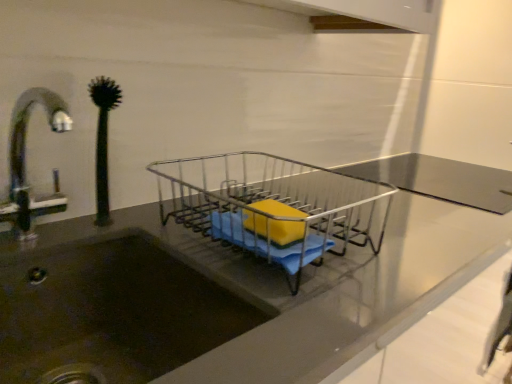
What do you see at coordinates (274, 206) in the screenshot? This screenshot has height=384, width=512. I see `metallic wire dish rack at center` at bounding box center [274, 206].

From the picture: Measure the distance between yellow sponge at center and camera.

25.71 inches.

You are a GUI agent. You are given a task and a screenshot of the screen. Output one action in this format:
    pyautogui.click(x=<x>, y=<y>)
    Task: Click on the green rubber plant at left
    
    Given the screenshot: What is the action you would take?
    pyautogui.click(x=103, y=142)

In order to click on metallic wire dish rack at center in this screenshot , I will do `click(274, 206)`.

Based on their positions, is green rubber plant at left located to the left or right of metallic wire dish rack at center?

Based on their positions, green rubber plant at left is located to the left of metallic wire dish rack at center.

Can you tell me how much green rubber plant at left and metallic wire dish rack at center differ in facing direction?

The angular difference between green rubber plant at left and metallic wire dish rack at center is 1.94e-05 degrees.

Is green rubber plant at left looking in the opposite direction of metallic wire dish rack at center?

green rubber plant at left is not turned away from metallic wire dish rack at center.

Is metallic wire dish rack at center located within green rubber plant at left?

No, green rubber plant at left does not contain metallic wire dish rack at center.

Based on their sizes in the image, would you say metallic wire dish rack at center is bigger or smaller than green rubber plant at left?

metallic wire dish rack at center is bigger than green rubber plant at left.

From a real-world perspective, who is located lower, metallic wire dish rack at center or green rubber plant at left?

metallic wire dish rack at center is physically lower.

Which is less distant, (379, 188) or (102, 207)?

Point (379, 188) appears to be farther away from the viewer than point (102, 207).

Would you say metallic wire dish rack at center is to the left or to the right of green rubber plant at left in the picture?

metallic wire dish rack at center is positioned on green rubber plant at left's right side.

Is yellow sponge at center positioned beyond the bounds of green rubber plant at left?

Yes, yellow sponge at center is not within green rubber plant at left.

Considering the relative sizes of yellow sponge at center and green rubber plant at left in the image provided, is yellow sponge at center taller than green rubber plant at left?

In fact, yellow sponge at center may be shorter than green rubber plant at left.

Which is more to the left, yellow sponge at center or green rubber plant at left?

green rubber plant at left.

From the image's perspective, is yellow sponge at center above or below green rubber plant at left?

Clearly, from the image's perspective, yellow sponge at center is below green rubber plant at left.

Is yellow sponge at center with metallic wire dish rack at center?

yellow sponge at center and metallic wire dish rack at center are not in contact.

From the image's perspective, is yellow sponge at center over metallic wire dish rack at center?

No, from the image's perspective, yellow sponge at center is not over metallic wire dish rack at center.

How many degrees apart are the facing directions of yellow sponge at center and metallic wire dish rack at center?

The facing directions of yellow sponge at center and metallic wire dish rack at center are 4.42 degrees apart.

From a real-world perspective, does yellow sponge at center sit lower than metallic wire dish rack at center?

No, from a real-world perspective, yellow sponge at center is not beneath metallic wire dish rack at center.

Is metallic wire dish rack at center not within yellow sponge at center?

Yes.

Which object is more forward, metallic wire dish rack at center or yellow sponge at center?

metallic wire dish rack at center is more forward.

Does metallic wire dish rack at center have a smaller size compared to yellow sponge at center?

Actually, metallic wire dish rack at center might be larger than yellow sponge at center.

In terms of width, does metallic wire dish rack at center look wider or thinner when compared to yellow sponge at center?

In the image, metallic wire dish rack at center appears to be wider than yellow sponge at center.

Is yellow sponge at center inside green rubber plant at left?

Definitely not — yellow sponge at center is not inside green rubber plant at left.

From the picture: Is green rubber plant at left to the left of yellow sponge at center from the viewer's perspective?

Indeed, green rubber plant at left is positioned on the left side of yellow sponge at center.

Is green rubber plant at left not close to yellow sponge at center?

They are positioned close to each other.

Can you tell me how much green rubber plant at left and yellow sponge at center differ in facing direction?

The facing directions of green rubber plant at left and yellow sponge at center are 4.42 degrees apart.

Where is `trolley below the green rubber plant at left (from a real-world perspective)`? The height and width of the screenshot is (384, 512). trolley below the green rubber plant at left (from a real-world perspective) is located at coordinates (274, 206).

Find the location of a particular element. The height and width of the screenshot is (384, 512). trolley that appears below the green rubber plant at left (from the image's perspective) is located at coordinates (274, 206).

Which object lies further to the anchor point green rubber plant at left, metallic wire dish rack at center or yellow sponge at center?

Based on the image, metallic wire dish rack at center appears to be further to green rubber plant at left.

Considering their positions, is yellow sponge at center positioned further to metallic wire dish rack at center than green rubber plant at left?

green rubber plant at left is further to metallic wire dish rack at center.

Based on their spatial positions, is green rubber plant at left or metallic wire dish rack at center closer to yellow sponge at center?

metallic wire dish rack at center lies closer to yellow sponge at center than the other object.

Estimate the real-world distances between objects in this image. Which object is further from green rubber plant at left, yellow sponge at center or metallic wire dish rack at center?

Based on the image, metallic wire dish rack at center appears to be further to green rubber plant at left.

Looking at the image, which one is located closer to metallic wire dish rack at center, green rubber plant at left or yellow sponge at center?

Among the two, yellow sponge at center is located nearer to metallic wire dish rack at center.

Considering their positions, is metallic wire dish rack at center positioned closer to yellow sponge at center than green rubber plant at left?

metallic wire dish rack at center.

Find the location of `trolley between green rubber plant at left and yellow sponge at center in the horizontal direction`. trolley between green rubber plant at left and yellow sponge at center in the horizontal direction is located at coordinates (274, 206).